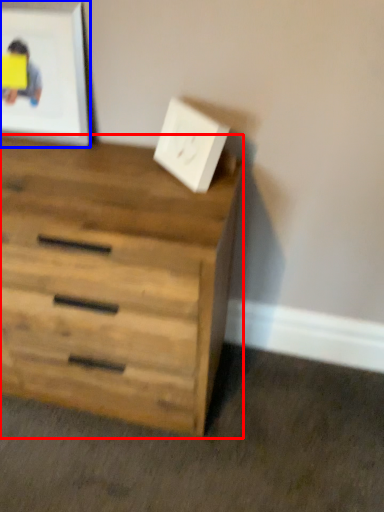
Question: Among these objects, which one is farthest to the camera, chest of drawers (highlighted by a red box) or picture frame (highlighted by a blue box)?

Choices:
 (A) chest of drawers
 (B) picture frame

Answer: (B)